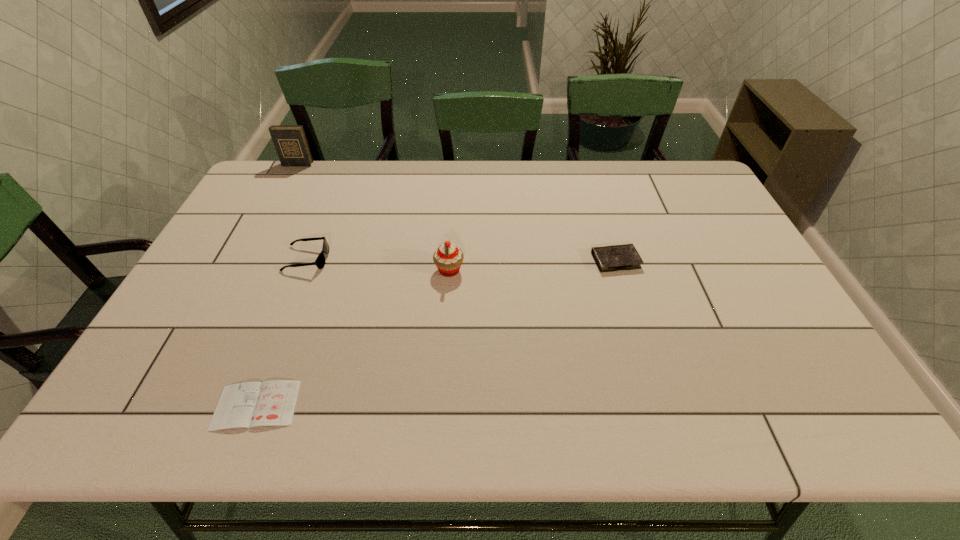
Where is `the farthest object`? This screenshot has height=540, width=960. the farthest object is located at coordinates (290, 141).

The image size is (960, 540). What are the coordinates of `the leftmost object` in the screenshot? It's located at click(x=290, y=141).

You are a GUI agent. You are given a task and a screenshot of the screen. Output one action in this format:
    pyautogui.click(x=<x>, y=<y>)
    Task: Click on the fourth object from left to right
    The height and width of the screenshot is (540, 960).
    Given the screenshot: What is the action you would take?
    pyautogui.click(x=448, y=258)

You are a GUI agent. You are given a task and a screenshot of the screen. Output one action in this format:
    pyautogui.click(x=<x>, y=<y>)
    Task: Click on the cupcake
    This screenshot has height=540, width=960.
    Given the screenshot: What is the action you would take?
    [448, 258]

At what (x,y) coordinates should I click in order to perform the action: click on the third tallest object. Please return your answer as a coordinate pair (x, y). The height and width of the screenshot is (540, 960). Looking at the image, I should click on (320, 261).

The image size is (960, 540). Identify the location of the rightmost diary. (611, 258).

This screenshot has width=960, height=540. Find the location of `the fourth tallest object`. the fourth tallest object is located at coordinates (611, 258).

Find the location of a particular element. The height and width of the screenshot is (540, 960). the second diary from right to left is located at coordinates (272, 403).

At what (x,y) coordinates should I click in order to perform the action: click on the shortest object. Please return your answer as a coordinate pair (x, y). Looking at the image, I should click on (272, 403).

You are a GUI agent. You are given a task and a screenshot of the screen. Output one action in this format:
    pyautogui.click(x=<x>, y=<y>)
    Task: Click on the vacant point located on the front cover of the leftmost diary
    The width and height of the screenshot is (960, 540).
    Given the screenshot: What is the action you would take?
    coord(275,207)